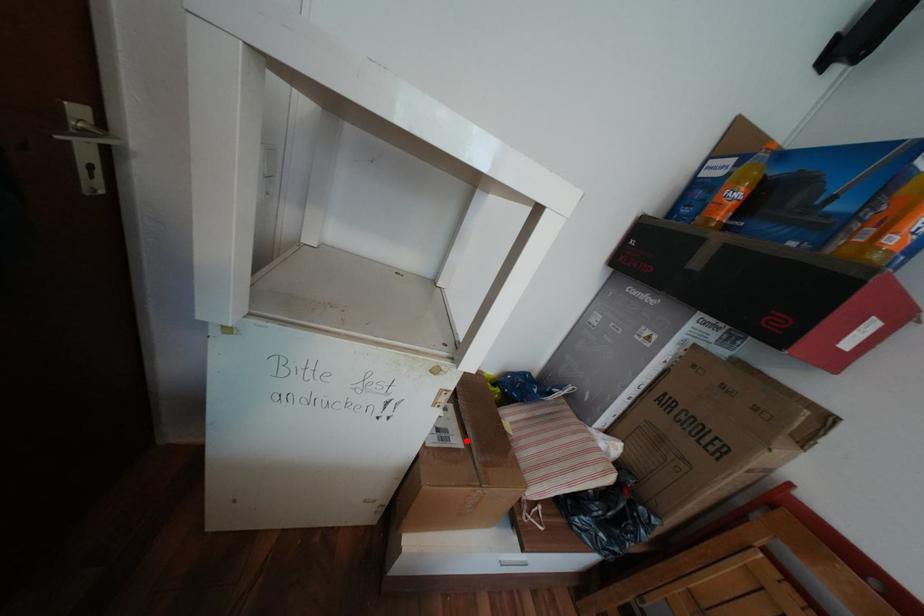
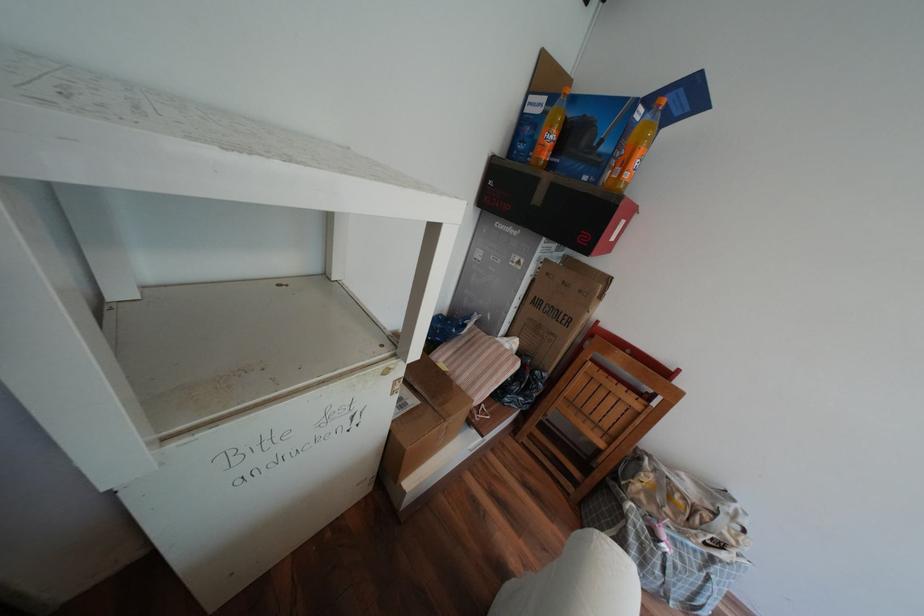
Question: I am providing you with two images of the same scene from different viewpoints. Image1 has a red point marked. In image2, the corresponding 3D location appears at what relative position? Reply with the corresponding letter.

Choices:
 (A) Closer
 (B) Farther

Answer: (B)